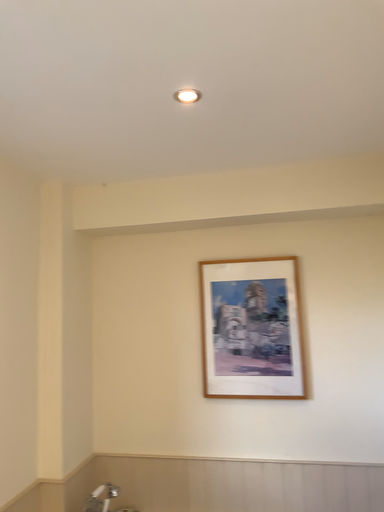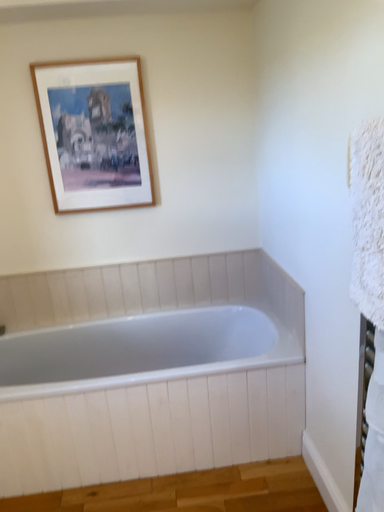
Question: Which way did the camera rotate in the video?

Choices:
 (A) rotated right
 (B) rotated left

Answer: (A)